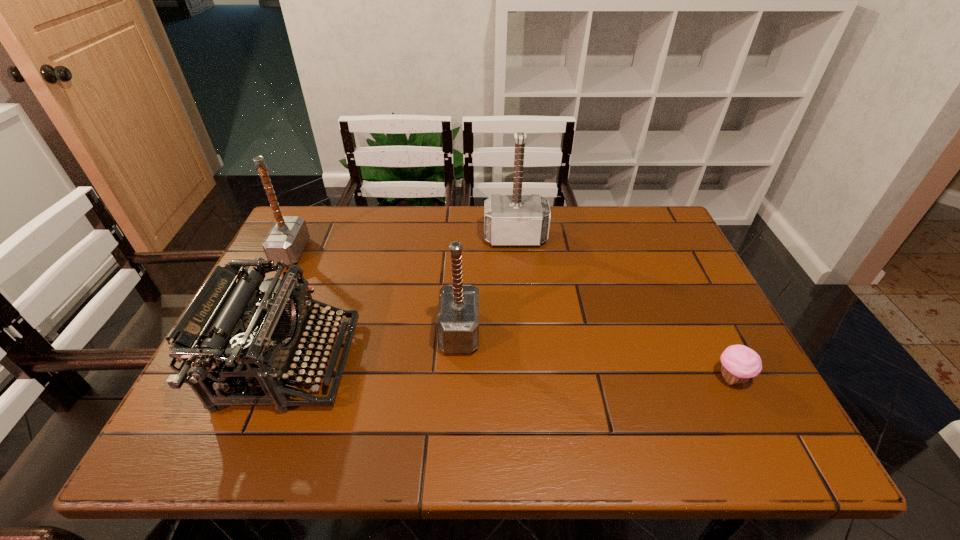
You are a GUI agent. You are given a task and a screenshot of the screen. Output one action in this format:
    pyautogui.click(x=<x>, y=<y>)
    Task: Click on the vacant area at the right edge
    Image resolution: width=960 pixels, height=540 pixels.
    Given the screenshot: What is the action you would take?
    pyautogui.click(x=720, y=323)

You are a GUI agent. You are given a task and a screenshot of the screen. Output one action in this format:
    pyautogui.click(x=<x>, y=<y>)
    Task: Click on the vacant space at the near right corner
    The height and width of the screenshot is (540, 960).
    Given the screenshot: What is the action you would take?
    pyautogui.click(x=744, y=431)

Identify the location of free space between the leftmost hammer and the cupcake. The width and height of the screenshot is (960, 540). (511, 315).

Locate an element on the screen. The image size is (960, 540). vacant area that lies between the third object from left to right and the leftmost hammer is located at coordinates (375, 292).

Where is `vacant area between the leftmost hammer and the second object from right to left`? The image size is (960, 540). vacant area between the leftmost hammer and the second object from right to left is located at coordinates (403, 245).

This screenshot has height=540, width=960. I want to click on empty space that is in between the second shortest object and the rightmost hammer, so click(x=402, y=300).

The height and width of the screenshot is (540, 960). In order to click on free spot between the typewriter and the second hammer from right to left in this screenshot , I will do `click(374, 348)`.

Locate an element on the screen. blank region between the leftmost hammer and the cupcake is located at coordinates point(511,315).

The height and width of the screenshot is (540, 960). What are the coordinates of `vacant space that is in between the rightmost hammer and the leftmost hammer` in the screenshot? It's located at (403, 245).

Image resolution: width=960 pixels, height=540 pixels. Find the location of `vacant space in between the shortest object and the typewriter`. vacant space in between the shortest object and the typewriter is located at coordinates (510, 370).